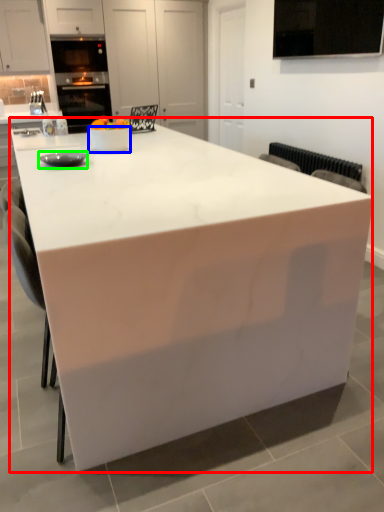
Question: Which is farther away from table (highlighted by a red box)? bowl (highlighted by a blue box) or appliance (highlighted by a green box)?

Choices:
 (A) bowl
 (B) appliance

Answer: (A)